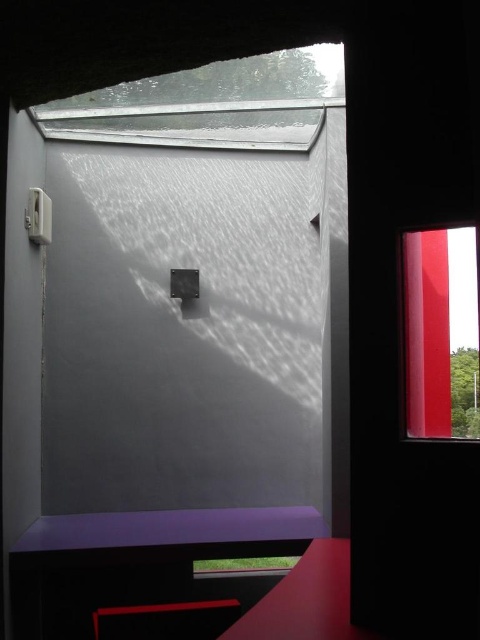
Question: Observing the image, what is the correct spatial positioning of transparent glass window at right in reference to matte purple stool at lower center?

Choices:
 (A) right
 (B) left

Answer: (A)

Question: Can you confirm if purple matte table at lower center is positioned above transparent glass window at right?

Choices:
 (A) no
 (B) yes

Answer: (A)

Question: Which of the following is the closest to the observer?

Choices:
 (A) (170, 515)
 (B) (152, 634)
 (C) (440, 269)

Answer: (B)

Question: Is transparent glass window at right wider than matte purple stool at lower center?

Choices:
 (A) yes
 (B) no

Answer: (B)

Question: Which object appears closest to the camera in this image?

Choices:
 (A) purple matte table at lower center
 (B) transparent glass window at right
 (C) matte purple stool at lower center

Answer: (B)

Question: Which of the following is the farthest from the observer?

Choices:
 (A) (472, 433)
 (B) (96, 534)
 (C) (218, 634)

Answer: (B)